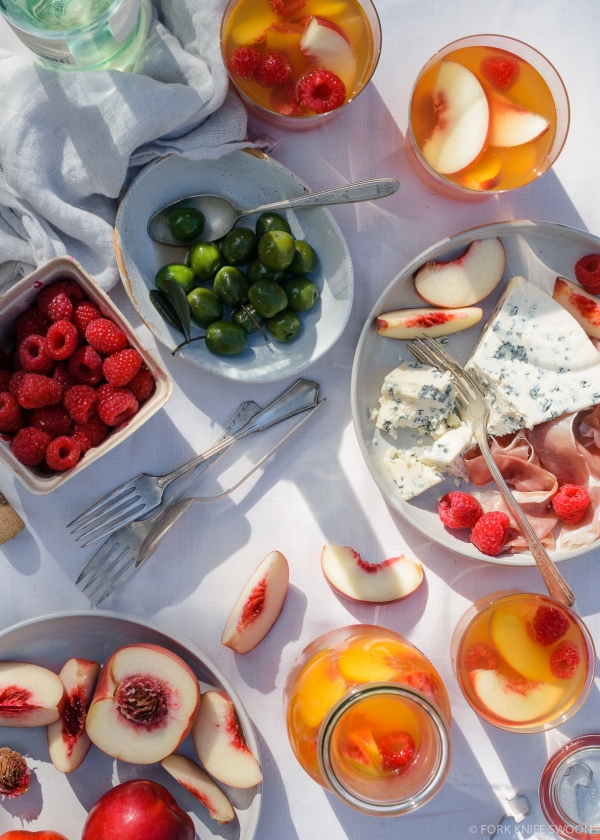
You are a GUI agent. You are given a task and a screenshot of the screen. Output one action in this format:
    pyautogui.click(x=<x>, y=<y>)
    Task: Click on the glass jar
    Image resolution: width=600 pixels, height=840 pixels.
    Given the screenshot: What is the action you would take?
    pyautogui.click(x=378, y=669)